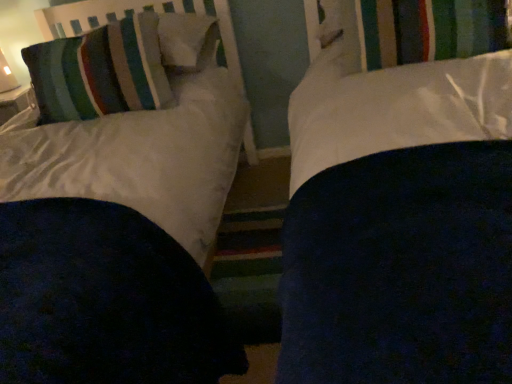
Question: Are striped fabric curtain at upper center and striped fabric pillow at upper left far apart?

Choices:
 (A) no
 (B) yes

Answer: (A)

Question: Does striped fabric curtain at upper center touch striped fabric pillow at upper left?

Choices:
 (A) yes
 (B) no

Answer: (B)

Question: Is striped fabric curtain at upper center positioned beyond the bounds of striped fabric pillow at upper left?

Choices:
 (A) yes
 (B) no

Answer: (A)

Question: Does striped fabric curtain at upper center have a greater height compared to striped fabric pillow at upper left?

Choices:
 (A) no
 (B) yes

Answer: (A)

Question: Is the depth of striped fabric curtain at upper center less than that of striped fabric pillow at upper left?

Choices:
 (A) yes
 (B) no

Answer: (A)

Question: Considering the positions of striped fabric headboard at upper left and striped fabric curtain at upper center in the image, is striped fabric headboard at upper left wider or thinner than striped fabric curtain at upper center?

Choices:
 (A) wide
 (B) thin

Answer: (A)

Question: From the image's perspective, is striped fabric headboard at upper left located above or below striped fabric curtain at upper center?

Choices:
 (A) below
 (B) above

Answer: (B)

Question: Is striped fabric headboard at upper left in front of or behind striped fabric curtain at upper center in the image?

Choices:
 (A) front
 (B) behind

Answer: (B)

Question: From a real-world perspective, is striped fabric headboard at upper left physically located above or below striped fabric curtain at upper center?

Choices:
 (A) below
 (B) above

Answer: (B)

Question: Looking at their shapes, would you say striped fabric pillow at upper left is wider or thinner than striped fabric curtain at upper center?

Choices:
 (A) thin
 (B) wide

Answer: (A)

Question: Is point (70, 52) positioned closer to the camera than point (406, 48)?

Choices:
 (A) farther
 (B) closer

Answer: (A)

Question: Based on their sizes in the image, would you say striped fabric pillow at upper left is bigger or smaller than striped fabric curtain at upper center?

Choices:
 (A) small
 (B) big

Answer: (B)

Question: In the image, is striped fabric pillow at upper left on the left side or the right side of striped fabric curtain at upper center?

Choices:
 (A) left
 (B) right

Answer: (A)

Question: Considering the positions of point (93, 54) and point (228, 29), is point (93, 54) closer or farther from the camera than point (228, 29)?

Choices:
 (A) farther
 (B) closer

Answer: (B)

Question: Would you say striped fabric pillow at upper left is inside or outside striped fabric headboard at upper left?

Choices:
 (A) outside
 (B) inside

Answer: (A)